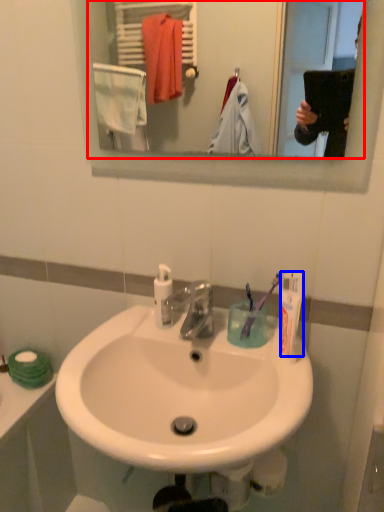
Question: Which of the following is the closest to the observer, mirror (highlighted by a red box) or toothpaste (highlighted by a blue box)?

Choices:
 (A) mirror
 (B) toothpaste

Answer: (A)